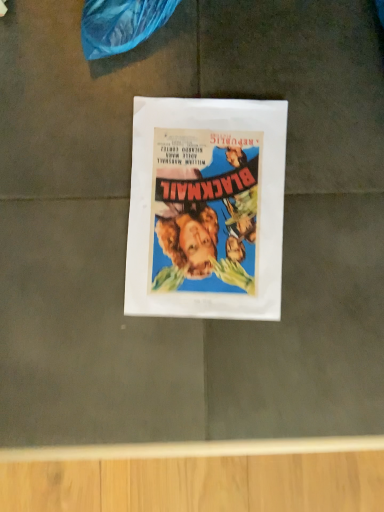
Image resolution: width=384 pixels, height=512 pixels. In order to click on matte paper poster at center in this screenshot , I will do `click(206, 208)`.

What is the approximate height of matte paper poster at center?

It is 0.43 inches.

What do you see at coordinates (206, 208) in the screenshot? This screenshot has height=512, width=384. I see `matte paper poster at center` at bounding box center [206, 208].

At what (x,y) coordinates should I click in order to perform the action: click on matte paper poster at center. Please return your answer as a coordinate pair (x, y). Looking at the image, I should click on (206, 208).